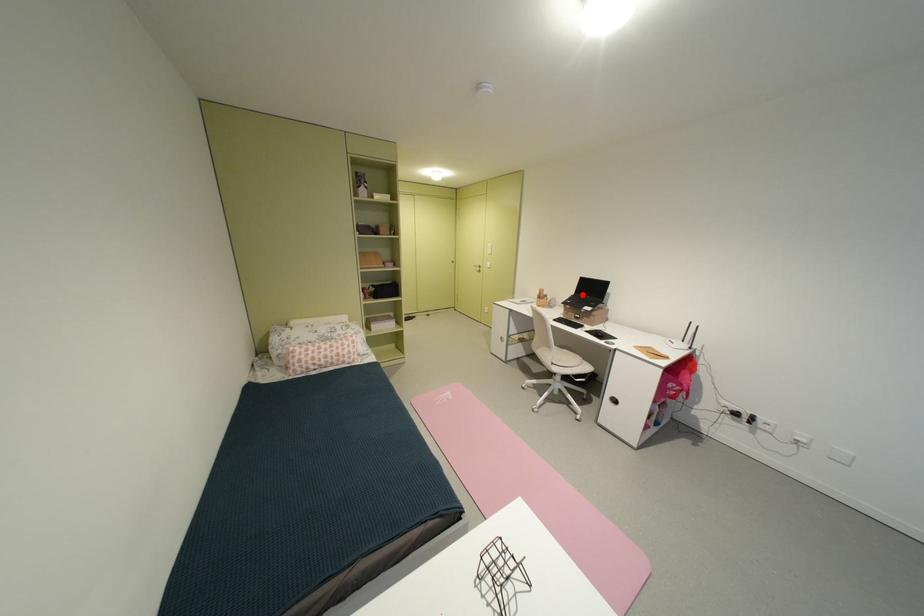
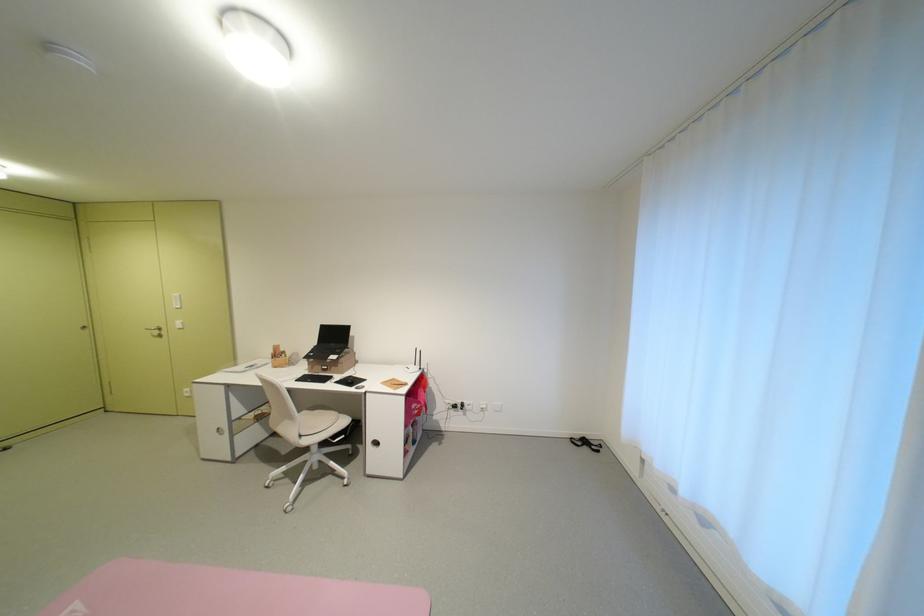
Question: I am providing you with two images of the same scene from different viewpoints. A red point is shown in image1. For the corresponding object point in image2, is it positioned nearer or farther from the camera?

Choices:
 (A) Nearer
 (B) Farther

Answer: (B)